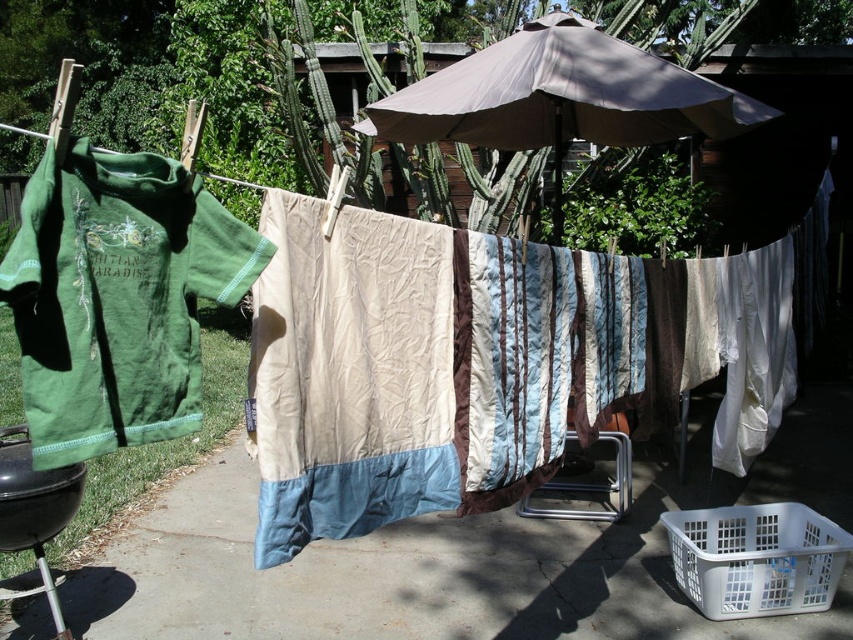
Does smooth concrete pavement at center appear on the left side of beige fabric umbrella at upper center?

Indeed, smooth concrete pavement at center is positioned on the left side of beige fabric umbrella at upper center.

Between smooth concrete pavement at center and beige fabric umbrella at upper center, which one is positioned lower?

smooth concrete pavement at center is lower down.

Image resolution: width=853 pixels, height=640 pixels. What do you see at coordinates (459, 560) in the screenshot?
I see `smooth concrete pavement at center` at bounding box center [459, 560].

Identify the location of smooth concrete pavement at center. (459, 560).

This screenshot has height=640, width=853. I want to click on green cotton blanket at left, so click(x=117, y=298).

Can you confirm if beige fabric umbrella at upper center is smaller than white plastic basket at lower right?

Actually, beige fabric umbrella at upper center might be larger than white plastic basket at lower right.

Does point (546, 26) lie in front of point (759, 516)?

No.

At what (x,y) coordinates should I click in order to perform the action: click on beige fabric umbrella at upper center. Please return your answer as a coordinate pair (x, y). The width and height of the screenshot is (853, 640). Looking at the image, I should click on (561, 97).